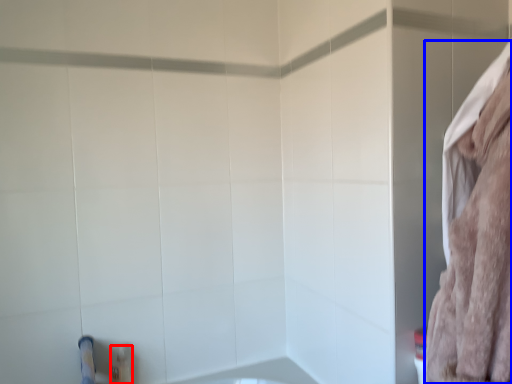
Question: Which of the following is the farthest to the observer, toiletry (highlighted by a red box) or bath towel (highlighted by a blue box)?

Choices:
 (A) toiletry
 (B) bath towel

Answer: (A)